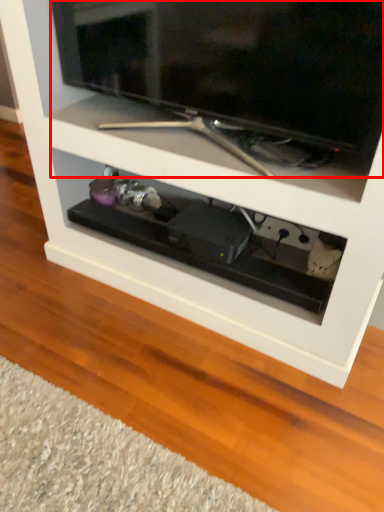
Question: Observing the image, what is the correct spatial positioning of television (annotated by the red box) in reference to drawer?

Choices:
 (A) left
 (B) right

Answer: (B)